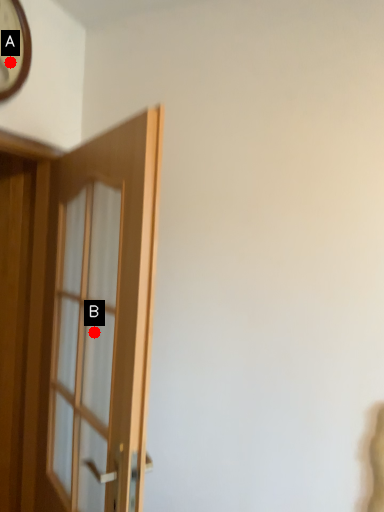
Question: Two points are circled on the image, labeled by A and B beside each circle. Which of the following is the farthest from the observer?

Choices:
 (A) A is further
 (B) B is further

Answer: (B)